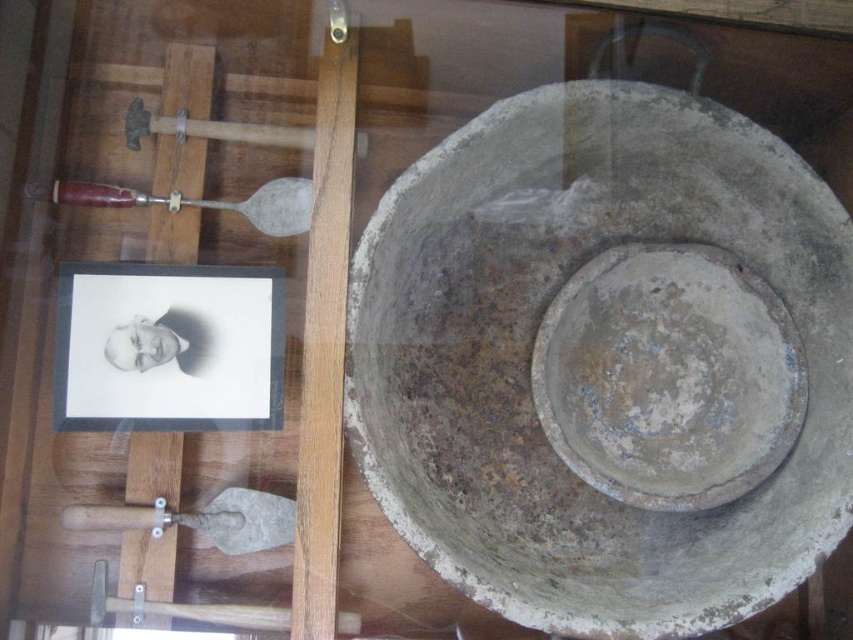
From the picture: Does wooden handle shovel at lower left come behind wooden handle shovel at left?

No, it is in front of wooden handle shovel at left.

Looking at this image, who is more forward, (209, 525) or (93, 204)?

Point (209, 525) is more forward.

Describe the element at coordinates (200, 518) in the screenshot. This screenshot has width=853, height=640. I see `wooden handle shovel at lower left` at that location.

Find the location of a particular element. The height and width of the screenshot is (640, 853). wooden handle shovel at lower left is located at coordinates (200, 518).